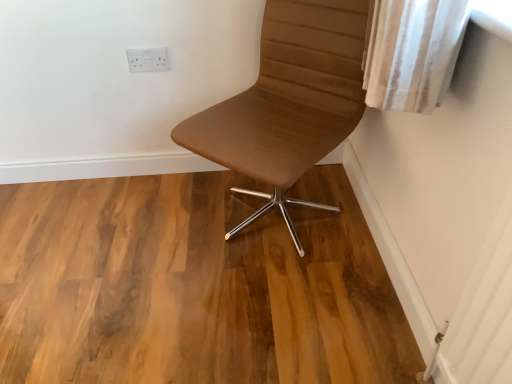
Where is `vacant space situated on the left part of brown leather chair at center`? vacant space situated on the left part of brown leather chair at center is located at coordinates (151, 225).